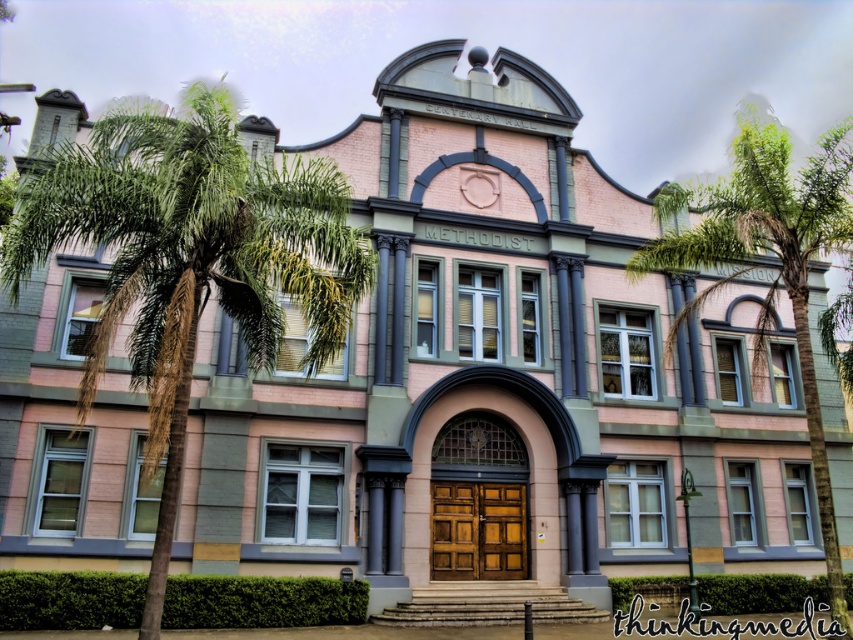
Question: Among these objects, which one is nearest to the camera?

Choices:
 (A) green leafy palm tree at left
 (B) green leafy palm tree at right

Answer: (A)

Question: Can you confirm if green leafy palm tree at left is bigger than green leafy palm tree at right?

Choices:
 (A) no
 (B) yes

Answer: (A)

Question: Can you confirm if green leafy palm tree at left is smaller than green leafy palm tree at right?

Choices:
 (A) no
 (B) yes

Answer: (B)

Question: Is green leafy palm tree at left to the left of green leafy palm tree at right from the viewer's perspective?

Choices:
 (A) yes
 (B) no

Answer: (A)

Question: Which point is closer to the camera taking this photo?

Choices:
 (A) (248, 342)
 (B) (737, 196)

Answer: (A)